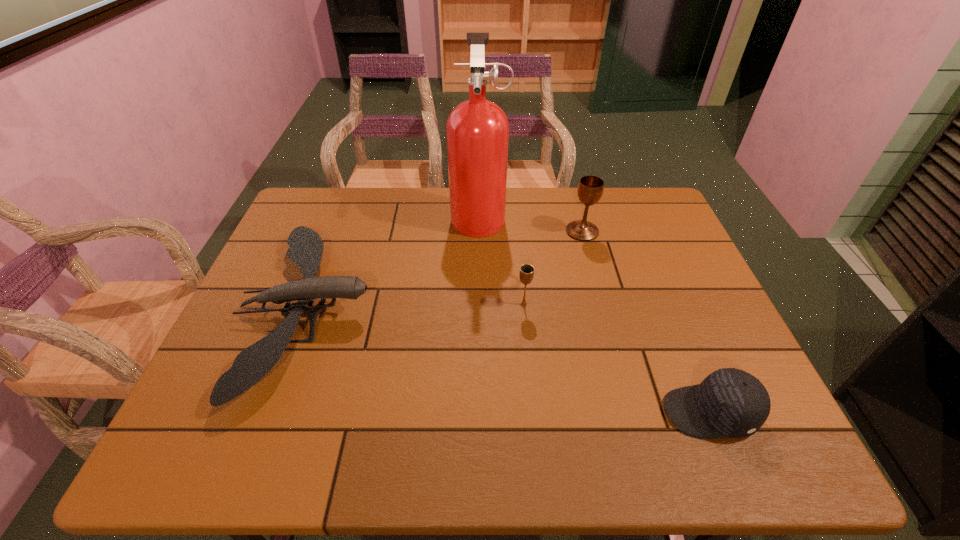
In order to click on vacant space that satisfies the following two spatial constraints: 1. on the front side of the fire extinguisher; 2. on the left side of the third object from right to left in this screenshot , I will do `click(479, 305)`.

Find the location of a particular element. This screenshot has width=960, height=540. vacant space that satisfies the following two spatial constraints: 1. on the front side of the fire extinguisher; 2. on the right side of the taller chalice is located at coordinates (479, 231).

You are a GUI agent. You are given a task and a screenshot of the screen. Output one action in this format:
    pyautogui.click(x=<x>, y=<y>)
    Task: Click on the free region that satisfies the following two spatial constraints: 1. on the front side of the fourth object from right to left; 2. on the right side of the second object from right to left
    Image resolution: width=960 pixels, height=540 pixels.
    Given the screenshot: What is the action you would take?
    pyautogui.click(x=479, y=231)

At what (x,y) coordinates should I click in order to perform the action: click on vacant area in the image that satisfies the following two spatial constraints: 1. on the front side of the right chalice; 2. at the head of the drone. Please return your answer as a coordinate pair (x, y). The width and height of the screenshot is (960, 540). Looking at the image, I should click on (604, 311).